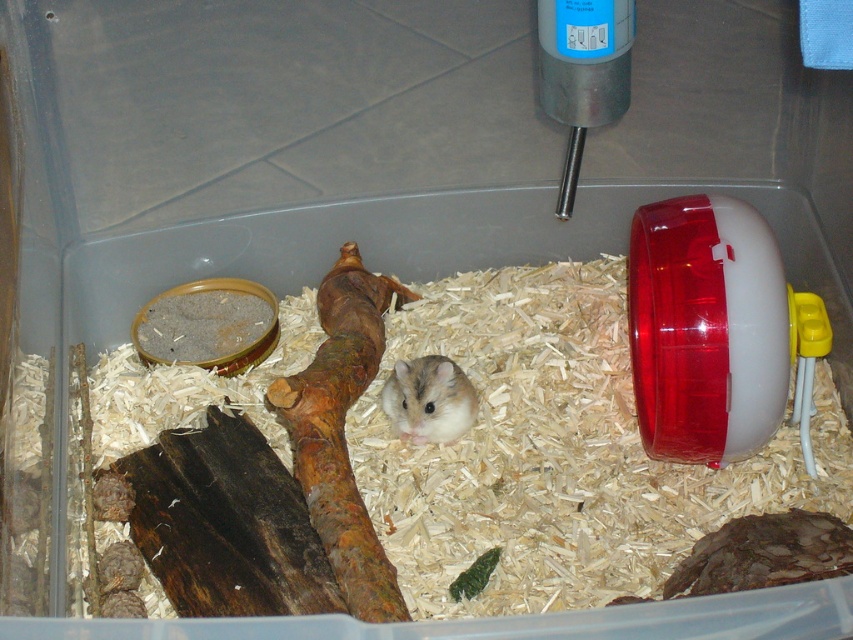
You are a small robot with a 0.1 unit wide sensor. You need to determine which of the two points, point (686, 353) or point (408, 380), is closer to you. Which point should your sensor focus on?

Point (686, 353) is closer to the viewer than point (408, 380), so the sensor should focus on point (686, 353).

You are a small pet owner who wants to place a treat for your hamster. The treat is placed on the transparent plastic wheel at right. The hamster is currently at the white fur hamster at center. Which direction should the hamster move to reach the treat?

The hamster should move to the right side to reach the treat on the transparent plastic wheel at right since it is positioned on the right side of the white fur hamster at center.

What is the 2D coordinate of the transparent plastic wheel at right in the image?

The transparent plastic wheel at right is located at the 2D coordinate point of (712, 328).